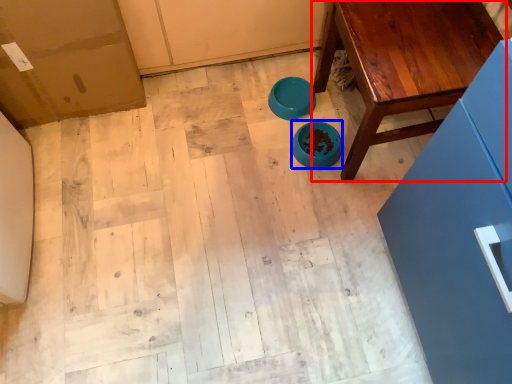
Question: Which point is further to the camera, table (highlighted by a red box) or bowl (highlighted by a blue box)?

Choices:
 (A) table
 (B) bowl

Answer: (B)